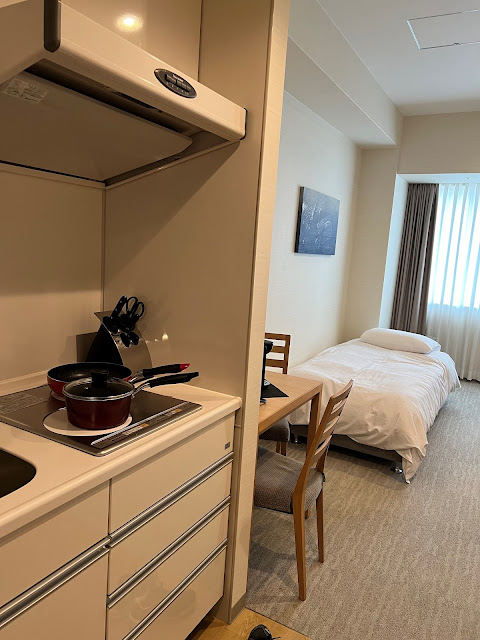
Locate an element on the screen. The height and width of the screenshot is (640, 480). empty space on countertop is located at coordinates (44, 461).